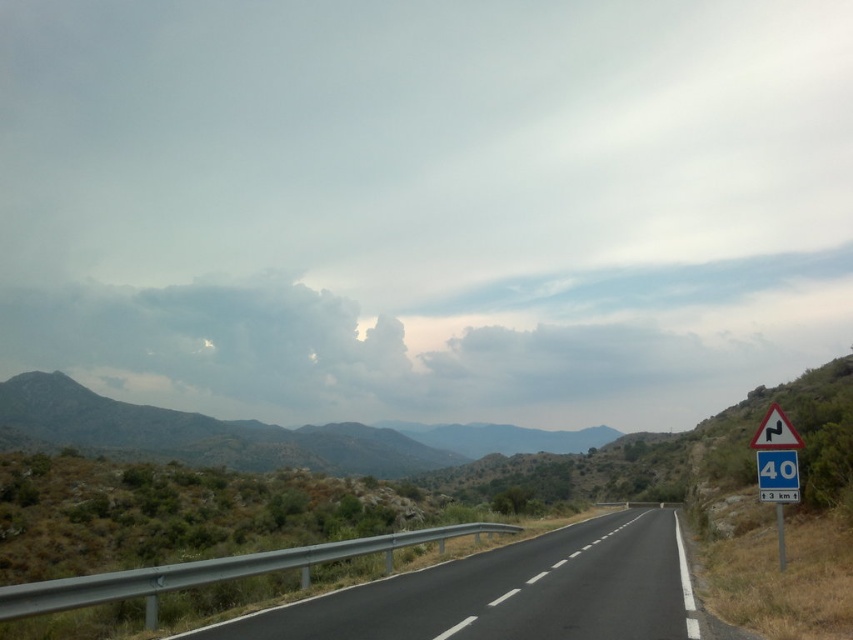
Does black asphalt road at center have a smaller size compared to green textured hillside at center?

Yes.

In the scene shown: Between black asphalt road at center and green textured hillside at center, which one is positioned lower?

Positioned lower is green textured hillside at center.

Locate an element on the screen. This screenshot has width=853, height=640. black asphalt road at center is located at coordinates (508, 593).

Between white plastic triangular sign at right and white plastic triangle at right, which one has less height?

white plastic triangular sign at right is shorter.

Which of these two, white plastic triangular sign at right or white plastic triangle at right, stands taller?

With more height is white plastic triangle at right.

Between point (784, 561) and point (770, 424), which one is positioned behind?

Positioned behind is point (784, 561).

Locate an element on the screen. white plastic triangular sign at right is located at coordinates (776, 467).

Does white plastic triangular sign at right appear over blue plastic speed limit sign at right?

Yes, white plastic triangular sign at right is above blue plastic speed limit sign at right.

Identify the location of white plastic triangular sign at right. (776, 467).

Does point (796, 492) come closer to viewer compared to point (792, 465)?

Yes, it is.

Where is `white plastic triangular sign at right`? This screenshot has height=640, width=853. white plastic triangular sign at right is located at coordinates (776, 467).